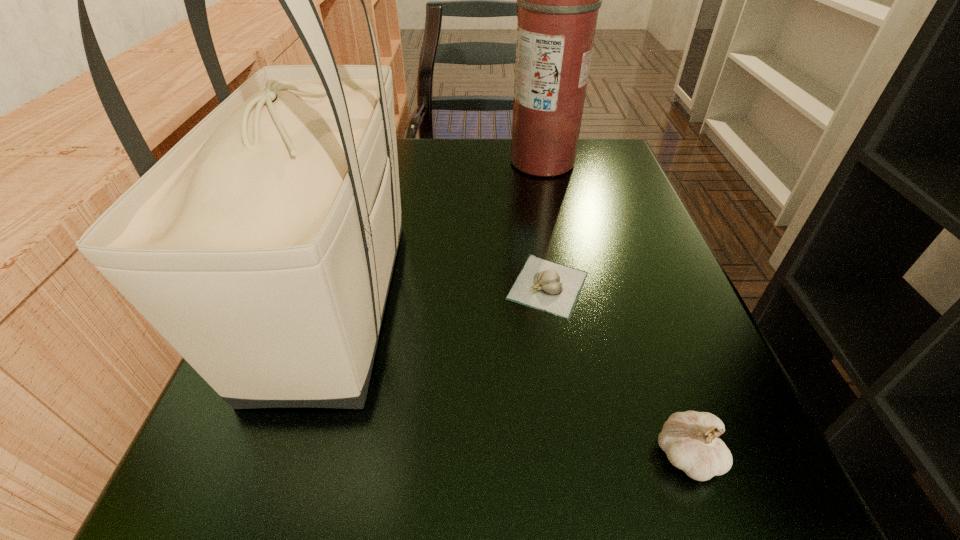
At what (x,y) coordinates should I click in order to perform the action: click on vacant space located 0.070m on the left of the second shortest object. Please return your answer as a coordinate pair (x, y). The width and height of the screenshot is (960, 540). Looking at the image, I should click on (591, 456).

Find the location of a particular element. This screenshot has width=960, height=540. free space located on the left of the farther garlic is located at coordinates (353, 286).

Find the location of a particular element. This screenshot has height=540, width=960. object at the far edge is located at coordinates (558, 0).

The width and height of the screenshot is (960, 540). I want to click on object that is at the near edge, so click(x=689, y=439).

This screenshot has height=540, width=960. I want to click on object that is positioned at the left edge, so click(x=261, y=246).

Where is `fire extinguisher that is at the right edge`? fire extinguisher that is at the right edge is located at coordinates (558, 0).

Where is `object situated at the far right corner`? The image size is (960, 540). object situated at the far right corner is located at coordinates (558, 0).

At what (x,y) coordinates should I click in order to perform the action: click on object that is at the near right corner. Please return your answer as a coordinate pair (x, y). This screenshot has width=960, height=540. Looking at the image, I should click on (689, 439).

The image size is (960, 540). I want to click on vacant space at the far edge of the desktop, so click(x=414, y=165).

Identify the location of blank area at the right edge. (600, 199).